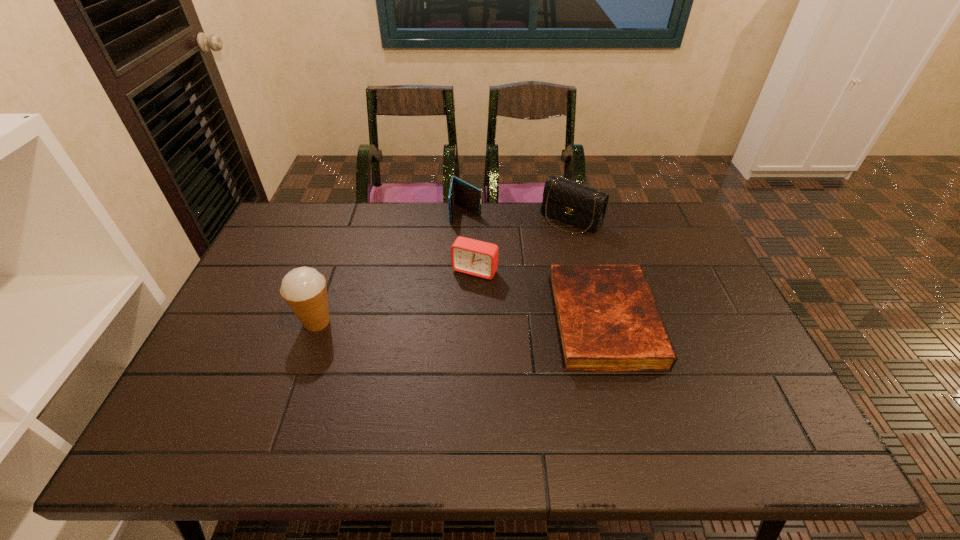
The height and width of the screenshot is (540, 960). Find the location of `the leftmost object`. the leftmost object is located at coordinates (304, 289).

Locate an element on the screen. the tallest object is located at coordinates (x=304, y=289).

This screenshot has height=540, width=960. In order to click on the shortest object in this screenshot , I will do `click(607, 319)`.

Where is `wallet`? The image size is (960, 540). wallet is located at coordinates (461, 193).

This screenshot has height=540, width=960. Identify the location of alarm clock. (469, 256).

Where is `clutch bag`? clutch bag is located at coordinates (582, 206).

This screenshot has height=540, width=960. I want to click on free space located on the right of the leftmost object, so click(422, 322).

Where is `vacant area situated on the spine side of the Bible`? This screenshot has height=540, width=960. vacant area situated on the spine side of the Bible is located at coordinates (697, 321).

The height and width of the screenshot is (540, 960). What are the coordinates of `blank space located 0.110m on the exterior surface of the wallet` in the screenshot? It's located at (463, 245).

This screenshot has width=960, height=540. What are the coordinates of `vacant position located on the exterior surface of the wallet` in the screenshot? It's located at (462, 252).